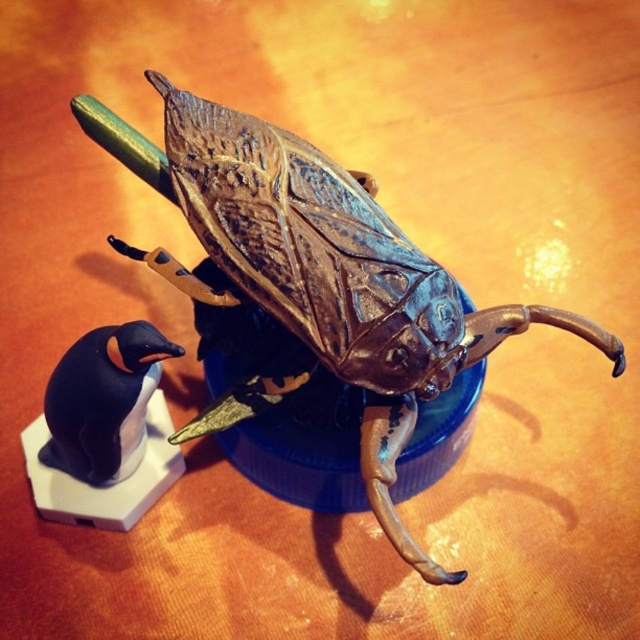
You are arranging a display on a shelf and need to place both the shiny metallic beetle at center and the black matte penguin at lower left. If you want to ensure the beetle is visible, where should you position it relative to the penguin?

The shiny metallic beetle at center should be placed in front of the black matte penguin at lower left to ensure it is visible.

You are standing at the point marked as point (304, 161) on the wooden surface. You want to place a small toy car that is 1 meter long between yourself and the edge of the table. Is there enough space to do so?

The distance between point (304, 161) and the viewer is 1.08 meters. Since the toy car is 1 meter long, there is enough space to place it between yourself and the edge of the table.

You are organizing a display on a narrow shelf that can only accommodate items up to 12 centimeters in width. You have the shiny metallic beetle at center and the black matte penguin at lower left. Based on their widths, which item might not fit on the shelf?

The shiny metallic beetle at center might not fit on the shelf because it might be wider than the black matte penguin at lower left, and the shelf has a maximum width capacity of 12 centimeters.